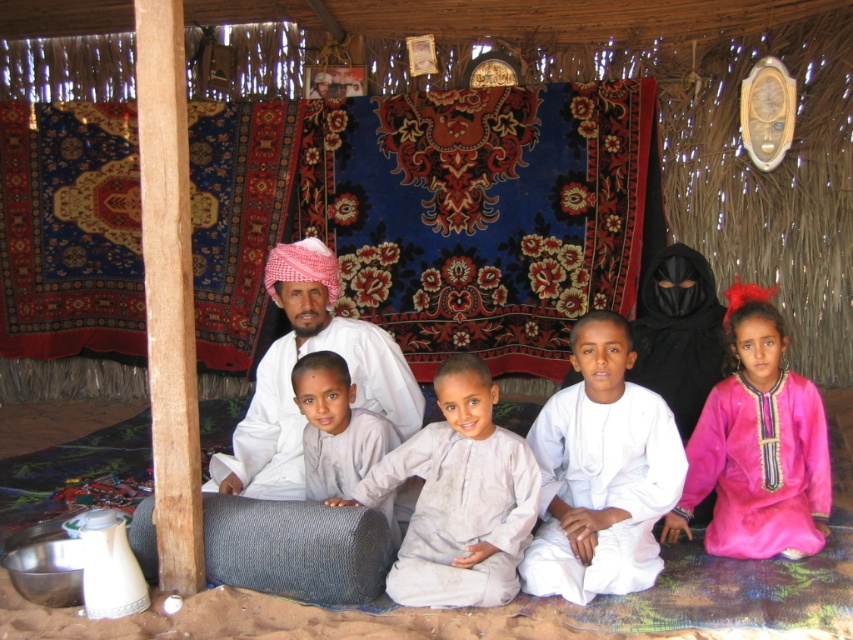
You are a photographer inside the tent and want to capture a photo of the pink satin dress at center and the light beige fabric at center. Which object should you focus on first if you want to ensure both are in focus without adjusting the camera settings?

The pink satin dress at center is taller than light beige fabric at center. To ensure both are in focus, focus on the pink satin dress at center because it is farther away, which will keep the light beige fabric at center in focus as well.

You are standing at the entrance of the tent and want to hand a gift to the person wearing the white cotton robe at center. Based on their position, which direction should you move to reach them?

The white cotton robe at center is located at point (299,412), so you should move towards the center of the tent to reach them.

You are a photographer inside the tent and want to ensure both the pink satin dress at center and the white cotton robe at center are visible in your photo. Given their sizes, which one might appear larger in the frame?

The pink satin dress at center has a greater height compared to the white cotton robe at center, so it will appear larger in the frame.